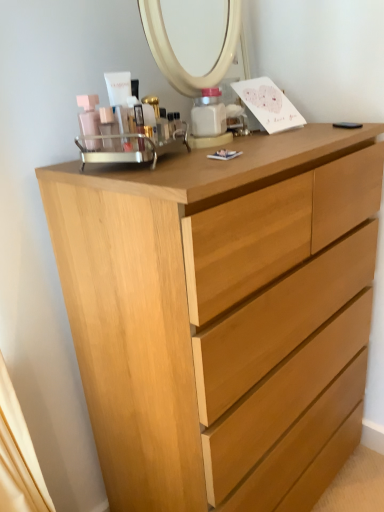
Question: From the image's perspective, is matte plastic container at center above or below light wood chest of drawers at center?

Choices:
 (A) below
 (B) above

Answer: (B)

Question: Considering the positions of matte plastic container at center and light wood chest of drawers at center in the image, is matte plastic container at center taller or shorter than light wood chest of drawers at center?

Choices:
 (A) tall
 (B) short

Answer: (B)

Question: Relative to light wood chest of drawers at center, is matte plastic container at center in front or behind?

Choices:
 (A) front
 (B) behind

Answer: (B)

Question: From a real-world perspective, is light wood chest of drawers at center positioned above or below matte plastic container at center?

Choices:
 (A) above
 (B) below

Answer: (B)

Question: In the image, is light wood chest of drawers at center positioned in front of or behind matte plastic container at center?

Choices:
 (A) front
 (B) behind

Answer: (A)

Question: Is light wood chest of drawers at center taller or shorter than matte plastic container at center?

Choices:
 (A) short
 (B) tall

Answer: (B)

Question: Considering the relative positions of light wood chest of drawers at center and matte plastic container at center in the image provided, is light wood chest of drawers at center to the left or to the right of matte plastic container at center?

Choices:
 (A) right
 (B) left

Answer: (A)